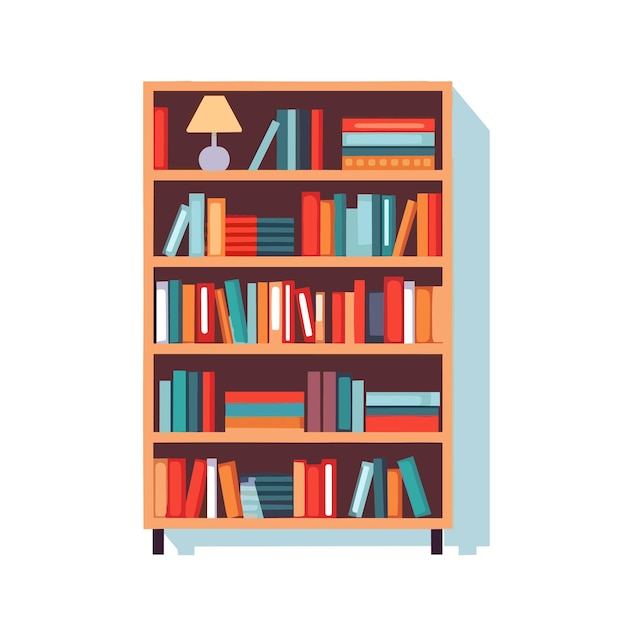
This screenshot has height=626, width=626. What are the coordinates of `books tilted to the side` in the screenshot? It's located at (192, 496), (225, 493), (354, 496), (414, 491), (222, 326), (303, 320), (406, 221), (172, 237), (255, 156).